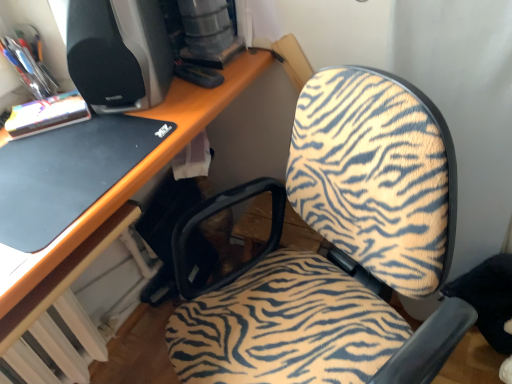
This screenshot has width=512, height=384. Identify the location of empty space that is ontop of black matte laptop at left. (64, 154).